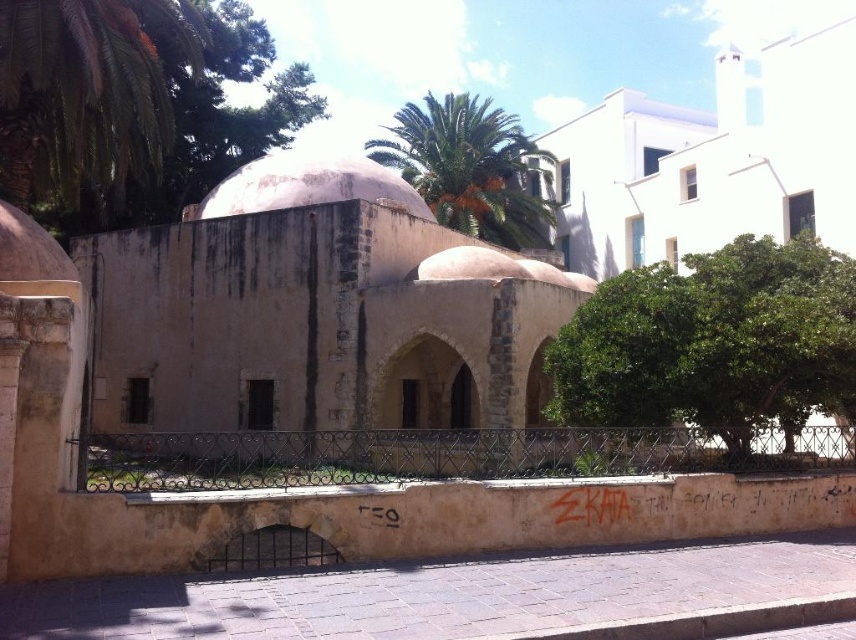
Is green leafy palm tree at upper left taller than green leafy palm tree at center?

No.

In the scene shown: Is green leafy palm tree at upper left thinner than green leafy palm tree at center?

Yes, green leafy palm tree at upper left is thinner than green leafy palm tree at center.

Identify the location of green leafy palm tree at upper left. Image resolution: width=856 pixels, height=640 pixels. (88, 92).

Does green leafy palm tree at center come in front of white matte dome at center?

No, green leafy palm tree at center is behind white matte dome at center.

Who is more distant from viewer, (485, 157) or (281, 208)?

The point (485, 157) is behind.

Identify the location of green leafy palm tree at center. (471, 168).

Is green leafy palm tree at upper left further to the viewer compared to white matte dome at center?

That is False.

Which is in front, point (175, 16) or point (394, 180)?

Point (175, 16)

What do you see at coordinates (88, 92) in the screenshot?
I see `green leafy palm tree at upper left` at bounding box center [88, 92].

This screenshot has height=640, width=856. Find the location of `green leafy palm tree at upper left`. green leafy palm tree at upper left is located at coordinates (88, 92).